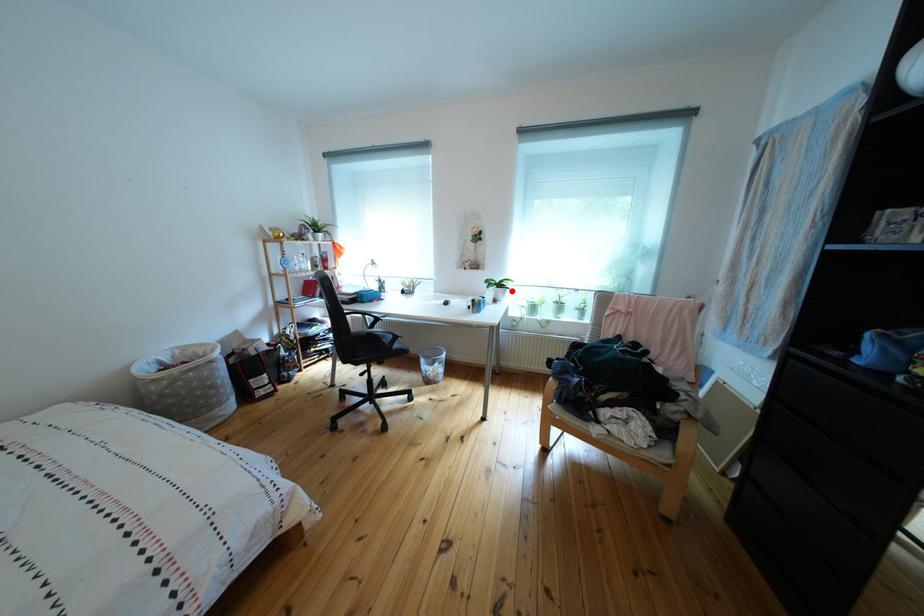
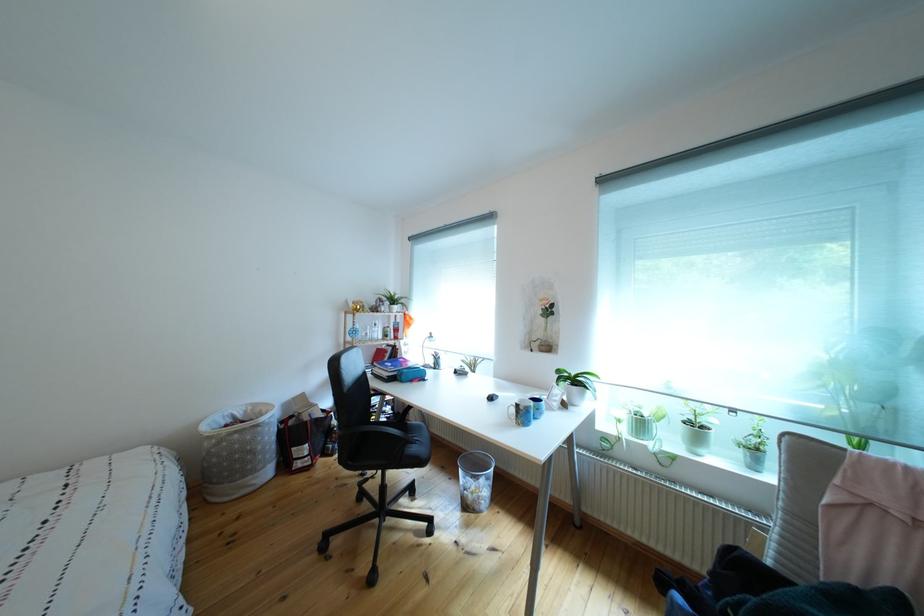
In the second image, find the point that corresponds to the highlighted location in the first image.

(588, 387)